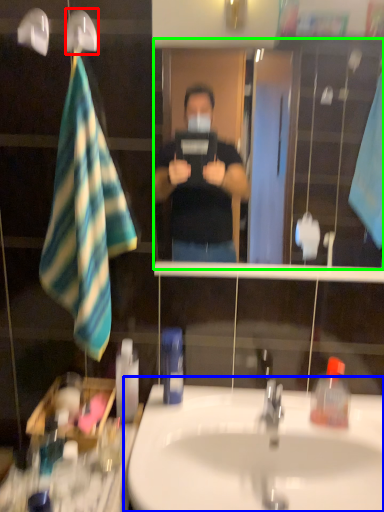
Question: Which is farther away from shower (highlighted by a red box)? sink (highlighted by a blue box) or mirror (highlighted by a green box)?

Choices:
 (A) sink
 (B) mirror

Answer: (B)